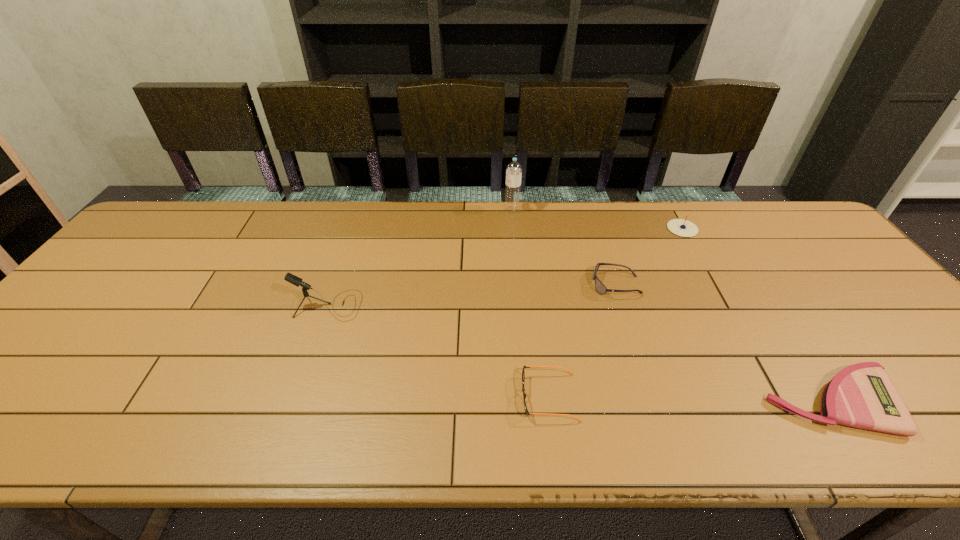
The height and width of the screenshot is (540, 960). What are the coordinates of `water bottle` in the screenshot? It's located at (514, 169).

Image resolution: width=960 pixels, height=540 pixels. Find the location of `the tallest object`. the tallest object is located at coordinates (514, 169).

I want to click on microphone, so click(289, 277).

Identify the location of the leftmost object. (289, 277).

Where is `the second farthest object`? the second farthest object is located at coordinates (680, 227).

Where is `the third tallest object`? Image resolution: width=960 pixels, height=540 pixels. the third tallest object is located at coordinates (680, 227).

Image resolution: width=960 pixels, height=540 pixels. I want to click on sunglasses, so click(x=599, y=286).

Find the location of a particular element. This screenshot has height=540, width=960. the fourth tallest object is located at coordinates (599, 286).

This screenshot has width=960, height=540. I want to click on wristlet, so click(x=862, y=395).

Identify the location of spectacles. (523, 372).